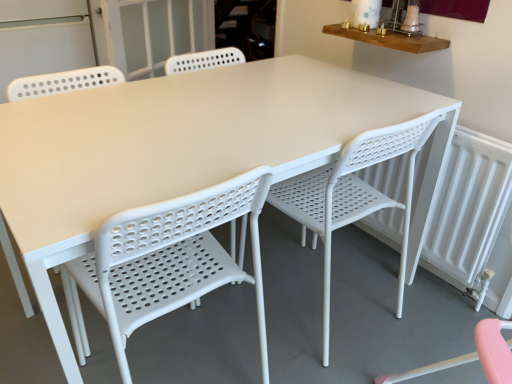
What are the coordinates of `transparent glass screen door at upper center, marked as the 2th screen door in a left-to-right arrangement` in the screenshot? It's located at (150, 32).

This screenshot has width=512, height=384. I want to click on white plastic radiator at right, so click(468, 209).

Measure the distance between white perforated screen door at upper left, the second screen door in the right-to-left sequence, and camera.

A distance of 2.03 meters exists between white perforated screen door at upper left, the second screen door in the right-to-left sequence, and camera.

This screenshot has width=512, height=384. Find the location of `transparent glass screen door at upper center, marked as the 2th screen door in a left-to-right arrangement`. transparent glass screen door at upper center, marked as the 2th screen door in a left-to-right arrangement is located at coordinates (150, 32).

Is white perforated screen door at upper left, placed as the first screen door when sorted from left to right, turned away from white plastic radiator at right?

white perforated screen door at upper left, placed as the first screen door when sorted from left to right, does not have its back to white plastic radiator at right.

Who is bigger, white perforated screen door at upper left, the second screen door in the right-to-left sequence, or white plastic radiator at right?

white perforated screen door at upper left, the second screen door in the right-to-left sequence, is bigger.

Is white perforated screen door at upper left, placed as the first screen door when sorted from left to right, to the left or to the right of white plastic radiator at right in the image?

Clearly, white perforated screen door at upper left, placed as the first screen door when sorted from left to right, is on the left of white plastic radiator at right in the image.

From the image's perspective, relative to white plastic radiator at right, is white perforated screen door at upper left, placed as the first screen door when sorted from left to right, above or below?

From the image's perspective, white perforated screen door at upper left, placed as the first screen door when sorted from left to right, appears above white plastic radiator at right.

Is white plastic radiator at right far away from white perforated screen door at upper left, the second screen door in the right-to-left sequence?

Yes, white plastic radiator at right and white perforated screen door at upper left, the second screen door in the right-to-left sequence, are quite far apart.

From a real-world perspective, is white plastic radiator at right above or below white perforated screen door at upper left, the second screen door in the right-to-left sequence?

white plastic radiator at right is situated lower than white perforated screen door at upper left, the second screen door in the right-to-left sequence, in the real world.

Considering the sizes of objects white plastic radiator at right and white perforated screen door at upper left, the second screen door in the right-to-left sequence, in the image provided, who is shorter, white plastic radiator at right or white perforated screen door at upper left, the second screen door in the right-to-left sequence,?

With less height is white plastic radiator at right.

Does white plastic radiator at right lie in front of white perforated screen door at upper left, the second screen door in the right-to-left sequence?

Yes, it is.

Is white perforated screen door at upper left, placed as the first screen door when sorted from left to right, bigger or smaller than white perforated plastic chair at center, arranged as the 2th chair when viewed from the right?

Clearly, white perforated screen door at upper left, placed as the first screen door when sorted from left to right, is larger in size than white perforated plastic chair at center, arranged as the 2th chair when viewed from the right.

Considering the sizes of white perforated screen door at upper left, placed as the first screen door when sorted from left to right, and white perforated plastic chair at center, arranged as the first chair when viewed from the left, in the image, is white perforated screen door at upper left, placed as the first screen door when sorted from left to right, wider or thinner than white perforated plastic chair at center, arranged as the first chair when viewed from the left,?

Clearly, white perforated screen door at upper left, placed as the first screen door when sorted from left to right, has more width compared to white perforated plastic chair at center, arranged as the first chair when viewed from the left.

Based on the photo, is white perforated screen door at upper left, the second screen door in the right-to-left sequence, outside of white perforated plastic chair at center, arranged as the first chair when viewed from the left?

Yes, white perforated screen door at upper left, the second screen door in the right-to-left sequence, is not within white perforated plastic chair at center, arranged as the first chair when viewed from the left.

Considering the points (37, 41) and (67, 290), which point is behind, point (37, 41) or point (67, 290)?

Positioned behind is point (37, 41).

Is white perforated plastic chair at center, arranged as the first chair when viewed from the left, looking in the opposite direction of white plastic chair at center, placed as the 1th chair when sorted from right to left?

white perforated plastic chair at center, arranged as the first chair when viewed from the left, is not turned away from white plastic chair at center, placed as the 1th chair when sorted from right to left.

From a real-world perspective, between white perforated plastic chair at center, arranged as the first chair when viewed from the left, and white plastic chair at center, placed as the second chair when sorted from left to right, who is vertically lower?

From a 3D spatial view, white plastic chair at center, placed as the second chair when sorted from left to right, is below.

From the image's perspective, which is below, transparent glass screen door at upper center, the first screen door from the right, or white plastic chair at center, placed as the 1th chair when sorted from right to left?

white plastic chair at center, placed as the 1th chair when sorted from right to left, is shown below in the image.

Consider the image. Is transparent glass screen door at upper center, the first screen door from the right, not close to white plastic chair at center, placed as the second chair when sorted from left to right?

transparent glass screen door at upper center, the first screen door from the right, is far away from white plastic chair at center, placed as the second chair when sorted from left to right.

Is transparent glass screen door at upper center, marked as the 2th screen door in a left-to-right arrangement, to the right of white plastic chair at center, placed as the 1th chair when sorted from right to left, from the viewer's perspective?

No.

Which is correct: transparent glass screen door at upper center, marked as the 2th screen door in a left-to-right arrangement, is inside white plastic chair at center, placed as the second chair when sorted from left to right, or outside of it?

transparent glass screen door at upper center, marked as the 2th screen door in a left-to-right arrangement, is not enclosed by white plastic chair at center, placed as the second chair when sorted from left to right.

Could you tell me if white perforated screen door at upper left, placed as the first screen door when sorted from left to right, is facing transparent glass screen door at upper center, marked as the 2th screen door in a left-to-right arrangement?

No, white perforated screen door at upper left, placed as the first screen door when sorted from left to right, is not aimed at transparent glass screen door at upper center, marked as the 2th screen door in a left-to-right arrangement.

Which object is wider, white perforated screen door at upper left, the second screen door in the right-to-left sequence, or transparent glass screen door at upper center, marked as the 2th screen door in a left-to-right arrangement?

white perforated screen door at upper left, the second screen door in the right-to-left sequence.

Is white perforated screen door at upper left, the second screen door in the right-to-left sequence, to the right of transparent glass screen door at upper center, marked as the 2th screen door in a left-to-right arrangement, from the viewer's perspective?

No.

From a real-world perspective, is white perforated screen door at upper left, the second screen door in the right-to-left sequence, above or below transparent glass screen door at upper center, the first screen door from the right?

In terms of real-world spatial position, white perforated screen door at upper left, the second screen door in the right-to-left sequence, is below transparent glass screen door at upper center, the first screen door from the right.

Would you say transparent glass screen door at upper center, the first screen door from the right, is inside or outside white perforated plastic chair at center, arranged as the first chair when viewed from the left?

transparent glass screen door at upper center, the first screen door from the right, exists outside the volume of white perforated plastic chair at center, arranged as the first chair when viewed from the left.

Between transparent glass screen door at upper center, marked as the 2th screen door in a left-to-right arrangement, and white perforated plastic chair at center, arranged as the first chair when viewed from the left, which one is positioned behind?

Positioned behind is transparent glass screen door at upper center, marked as the 2th screen door in a left-to-right arrangement.

Considering the sizes of transparent glass screen door at upper center, the first screen door from the right, and white perforated plastic chair at center, arranged as the 2th chair when viewed from the right, in the image, is transparent glass screen door at upper center, the first screen door from the right, wider or thinner than white perforated plastic chair at center, arranged as the 2th chair when viewed from the right,?

transparent glass screen door at upper center, the first screen door from the right, is thinner than white perforated plastic chair at center, arranged as the 2th chair when viewed from the right.

In terms of size, does transparent glass screen door at upper center, marked as the 2th screen door in a left-to-right arrangement, appear bigger or smaller than white perforated plastic chair at center, arranged as the first chair when viewed from the left?

Considering their sizes, transparent glass screen door at upper center, marked as the 2th screen door in a left-to-right arrangement, takes up less space than white perforated plastic chair at center, arranged as the first chair when viewed from the left.

Locate an element on the screen. the 2nd screen door behind when counting from the white plastic radiator at right is located at coordinates (42, 38).

Find the location of a particular element. radiator on the right of white perforated screen door at upper left, the second screen door in the right-to-left sequence is located at coordinates (468, 209).

When comparing their distances from white plastic chair at center, placed as the 1th chair when sorted from right to left, does white perforated plastic chair at center, arranged as the first chair when viewed from the left, or white perforated screen door at upper left, the second screen door in the right-to-left sequence, seem closer?

white perforated plastic chair at center, arranged as the first chair when viewed from the left, is closer to white plastic chair at center, placed as the 1th chair when sorted from right to left.

Looking at the image, which one is located closer to white perforated plastic chair at center, arranged as the first chair when viewed from the left, white plastic radiator at right or white plastic chair at center, placed as the 1th chair when sorted from right to left?

Based on the image, white plastic chair at center, placed as the 1th chair when sorted from right to left, appears to be nearer to white perforated plastic chair at center, arranged as the first chair when viewed from the left.

Based on their spatial positions, is white plastic chair at center, placed as the 1th chair when sorted from right to left, or transparent glass screen door at upper center, the first screen door from the right, closer to white perforated plastic chair at center, arranged as the first chair when viewed from the left?

white plastic chair at center, placed as the 1th chair when sorted from right to left.

Estimate the real-world distances between objects in this image. Which object is closer to white perforated plastic chair at center, arranged as the first chair when viewed from the left, white perforated screen door at upper left, the second screen door in the right-to-left sequence, or transparent glass screen door at upper center, marked as the 2th screen door in a left-to-right arrangement?

Among the two, transparent glass screen door at upper center, marked as the 2th screen door in a left-to-right arrangement, is located nearer to white perforated plastic chair at center, arranged as the first chair when viewed from the left.

Estimate the real-world distances between objects in this image. Which object is further from white perforated screen door at upper left, placed as the first screen door when sorted from left to right, white plastic chair at center, placed as the second chair when sorted from left to right, or transparent glass screen door at upper center, the first screen door from the right?

The object further to white perforated screen door at upper left, placed as the first screen door when sorted from left to right, is white plastic chair at center, placed as the second chair when sorted from left to right.

Which object lies nearer to the anchor point white perforated screen door at upper left, placed as the first screen door when sorted from left to right, white plastic radiator at right or white perforated plastic chair at center, arranged as the 2th chair when viewed from the right?

white perforated plastic chair at center, arranged as the 2th chair when viewed from the right, lies closer to white perforated screen door at upper left, placed as the first screen door when sorted from left to right, than the other object.

When comparing their distances from white perforated plastic chair at center, arranged as the first chair when viewed from the left, does white plastic radiator at right or white perforated screen door at upper left, placed as the first screen door when sorted from left to right, seem closer?

Based on the image, white plastic radiator at right appears to be nearer to white perforated plastic chair at center, arranged as the first chair when viewed from the left.

Considering their positions, is white plastic chair at center, placed as the 1th chair when sorted from right to left, positioned closer to white perforated screen door at upper left, placed as the first screen door when sorted from left to right, than white perforated plastic chair at center, arranged as the 2th chair when viewed from the right?

white perforated plastic chair at center, arranged as the 2th chair when viewed from the right, is closer to white perforated screen door at upper left, placed as the first screen door when sorted from left to right.

Where is `chair between white perforated plastic chair at center, arranged as the first chair when viewed from the left, and white plastic radiator at right from left to right`? The width and height of the screenshot is (512, 384). chair between white perforated plastic chair at center, arranged as the first chair when viewed from the left, and white plastic radiator at right from left to right is located at coordinates (352, 194).

The image size is (512, 384). Identify the location of radiator between white perforated plastic chair at center, arranged as the first chair when viewed from the left, and transparent glass screen door at upper center, marked as the 2th screen door in a left-to-right arrangement, along the z-axis. (468, 209).

This screenshot has width=512, height=384. I want to click on chair between white perforated plastic chair at center, arranged as the first chair when viewed from the left, and transparent glass screen door at upper center, marked as the 2th screen door in a left-to-right arrangement, in the front-back direction, so coord(352,194).

Where is `chair between white perforated screen door at upper left, the second screen door in the right-to-left sequence, and white plastic chair at center, placed as the 1th chair when sorted from right to left, in the horizontal direction`? The image size is (512, 384). chair between white perforated screen door at upper left, the second screen door in the right-to-left sequence, and white plastic chair at center, placed as the 1th chair when sorted from right to left, in the horizontal direction is located at coordinates (167, 261).